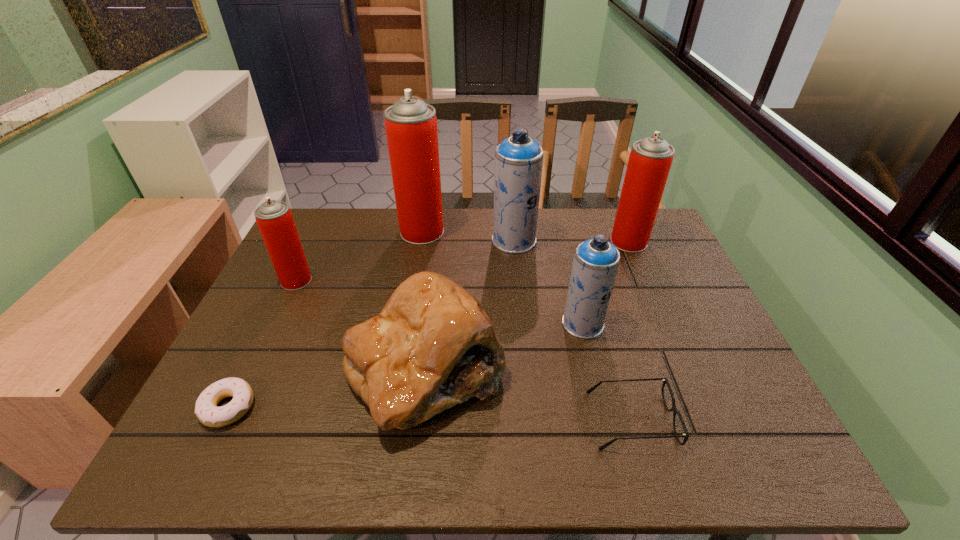
The width and height of the screenshot is (960, 540). I want to click on the third shortest object, so click(433, 346).

Where is `brownish-beige bread`? The height and width of the screenshot is (540, 960). brownish-beige bread is located at coordinates (433, 346).

Find the location of a particular element. This screenshot has height=540, width=960. the seventh tallest object is located at coordinates (665, 381).

The width and height of the screenshot is (960, 540). Find the location of `white doughnut`. white doughnut is located at coordinates (206, 410).

This screenshot has width=960, height=540. I want to click on doughnut, so click(206, 410).

This screenshot has width=960, height=540. What are the coordinates of `free space located 0.240m on the front of the tallest aerosol can` in the screenshot? It's located at (411, 298).

Identify the location of free space located on the left of the second smallest red aerosol can. The height and width of the screenshot is (540, 960). (484, 242).

Find the location of a particular element. The width and height of the screenshot is (960, 540). free region located 0.110m on the back of the left blue aerosol can is located at coordinates (511, 210).

Find the location of a particular element. This screenshot has height=540, width=960. free space located 0.310m on the front of the leftmost red aerosol can is located at coordinates (247, 384).

This screenshot has height=540, width=960. What are the coordinates of `vacant position located on the right of the right blue aerosol can` in the screenshot? It's located at (631, 324).